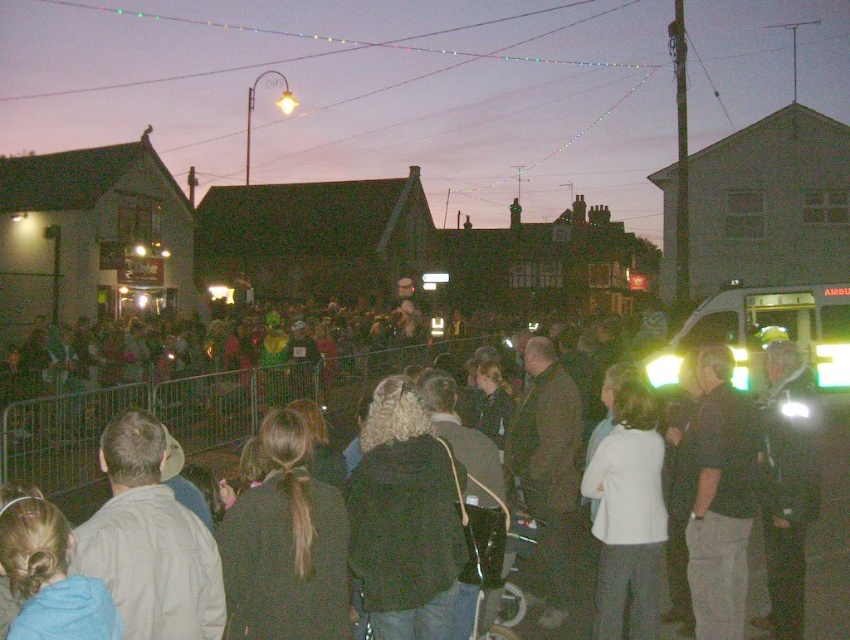
You are standing at the center of the scene and want to take a photo that includes both the point at point [191,419] and the point at point [621,577]. Which point should you focus on to ensure both are in clear view?

You should focus on point [191,419] because it is closer to the camera than point [621,577]. This will ensure that both points are in focus since focusing on the closer object typically keeps the farther one within the depth of field.

You are organizing a photo shoot and need to ensure that all participants are visible in the frame. Given that the dark gray clothing at center and the white matte jacket at center are both central to the composition, which participant should you adjust to avoid overcrowding?

The dark gray clothing at center has a larger width than the white matte jacket at center, so adjusting the position of the dark gray clothing at center would help prevent overcrowding in the central area.